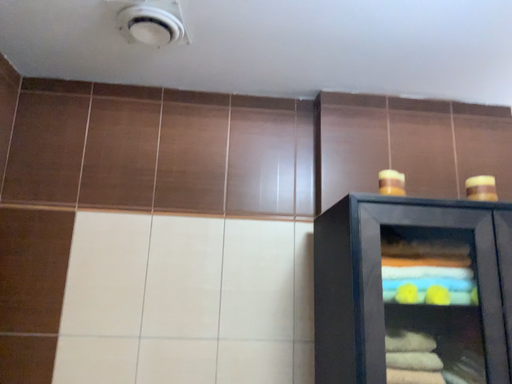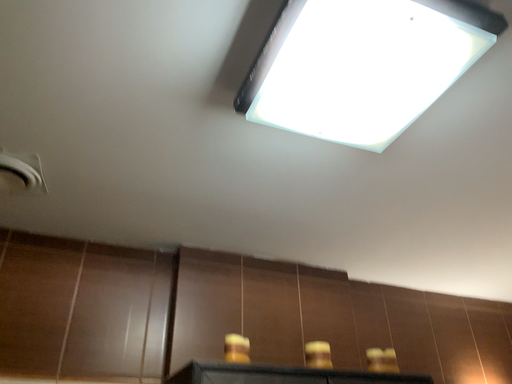
Question: How did the camera likely rotate when shooting the video?

Choices:
 (A) rotated right
 (B) rotated left

Answer: (A)